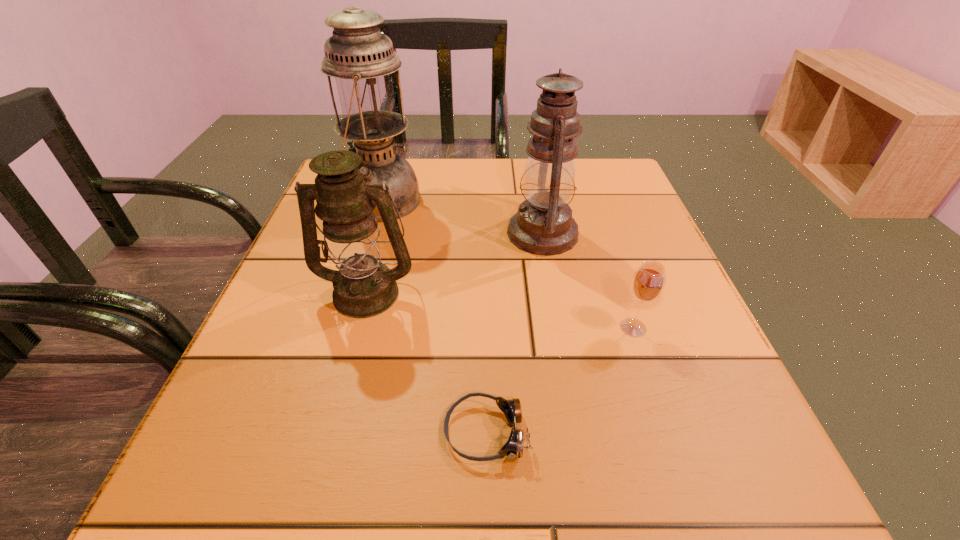
At what (x,y) coordinates should I click in order to perform the action: click on vacant area between the second tallest object and the nearest oil lamp. Please return your answer as a coordinate pair (x, y). The height and width of the screenshot is (540, 960). Looking at the image, I should click on (455, 262).

Identify the location of vacant space that's between the rightmost object and the nearest oil lamp. This screenshot has height=540, width=960. (500, 310).

Locate an element on the screen. object that can be found as the fourth closest to the tallest oil lamp is located at coordinates (648, 282).

Identify which object is the third closest to the nearest oil lamp. Please provide its 2D coordinates. Your answer should be formatted as a tuple, i.e. [(x, y)], where the tuple contains the x and y coordinates of a point satisfying the conditions above.

[(513, 448)]

In order to click on oil lamp that is the second closest to the second shortest oil lamp in this screenshot , I will do `click(361, 59)`.

This screenshot has width=960, height=540. Find the location of `oil lamp that is the third closest to the rightmost object`. oil lamp that is the third closest to the rightmost object is located at coordinates (361, 59).

Where is `free location that satisfies the following two spatial constraints: 1. on the front side of the wineglass; 2. on the left side of the shortest oil lamp`? free location that satisfies the following two spatial constraints: 1. on the front side of the wineglass; 2. on the left side of the shortest oil lamp is located at coordinates (357, 328).